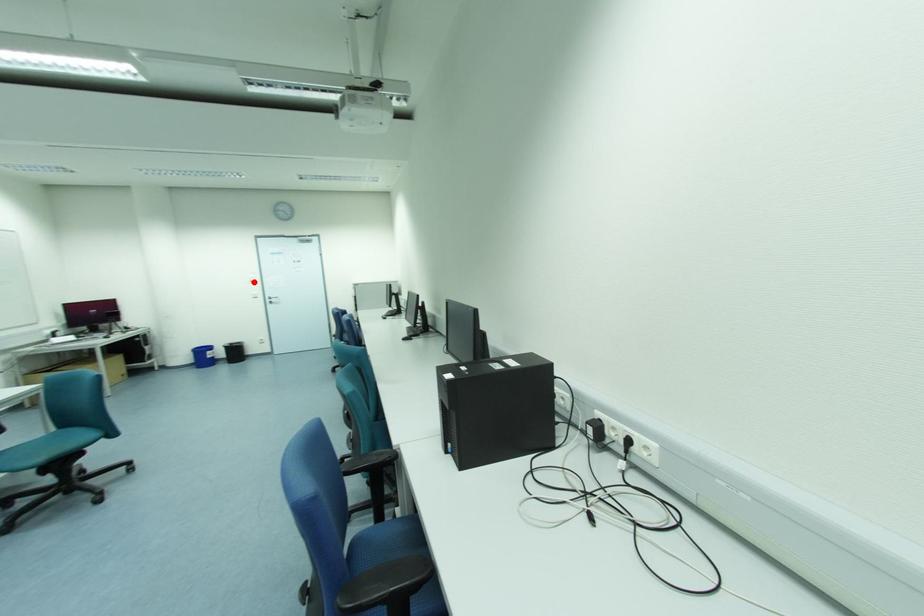
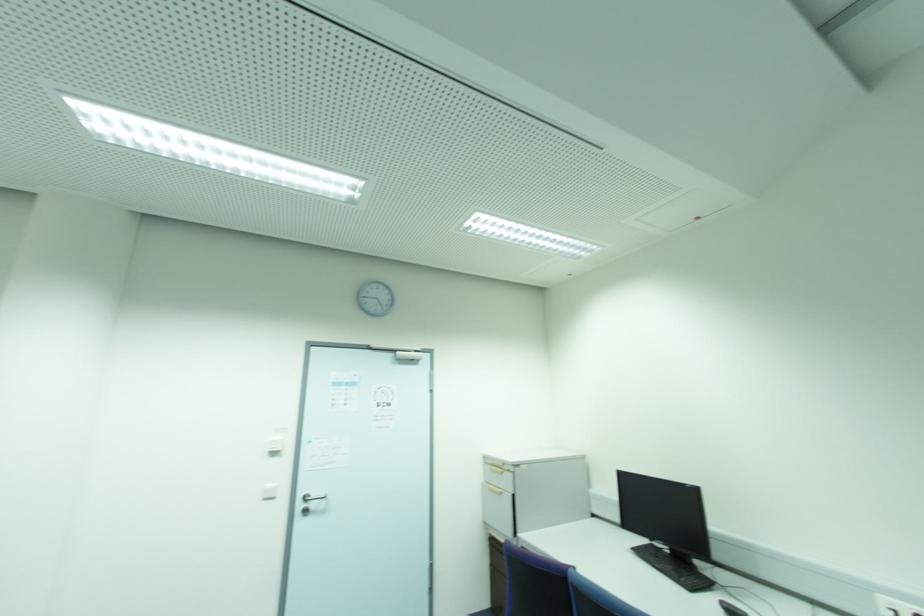
In the second image, find the point that corresponds to the highlighted location in the first image.

(274, 454)